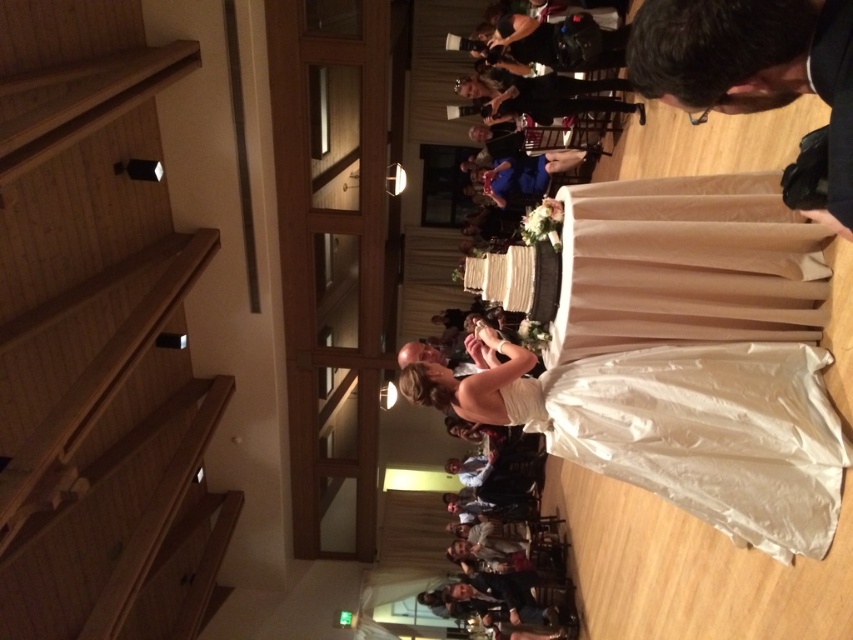
Which of these two, white satin dress at center or black leather camera at upper right, stands taller?

black leather camera at upper right

Can you confirm if white satin dress at center is wider than black leather camera at upper right?

No.

Is point (688, 577) behind point (675, 20)?

Yes, it is.

Where is `white satin dress at center`? Image resolution: width=853 pixels, height=640 pixels. white satin dress at center is located at coordinates (688, 568).

Can you confirm if light brown wooden stairs at left is taller than black leather camera at upper right?

Yes, light brown wooden stairs at left is taller than black leather camera at upper right.

The width and height of the screenshot is (853, 640). I want to click on light brown wooden stairs at left, so click(x=97, y=339).

This screenshot has width=853, height=640. I want to click on light brown wooden stairs at left, so click(97, 339).

Is light brown wooden stairs at left taller than white satin dress at center?

Yes, light brown wooden stairs at left is taller than white satin dress at center.

Can you confirm if light brown wooden stairs at left is shorter than white satin dress at center?

No.

Is point (140, 538) in front of point (630, 541)?

No, (140, 538) is behind (630, 541).

I want to click on light brown wooden stairs at left, so click(x=97, y=339).